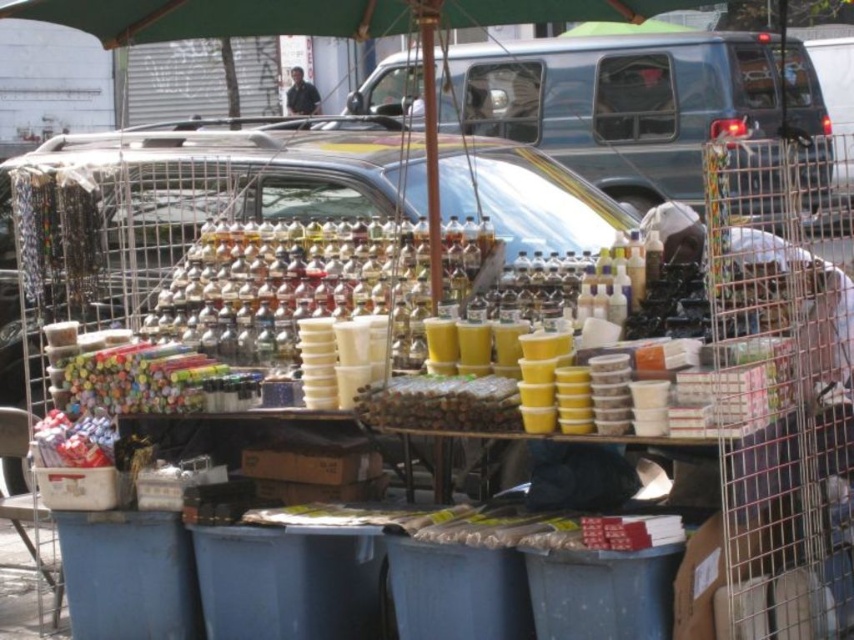
You are a customer at the market stall and want to buy a drink. You notice the metallic blue van at center and the dark blue shirt at center. Which one is larger in size?

The metallic blue van at center is bigger than the dark blue shirt at center.

You are a customer at the market stall and want to locate the metallic blue van at center. Based on the coordinates provided, where would you find the point [617,102] in relation to the van?

The point [617,102] is located on the metallic blue van at center, so it is part of the van itself.